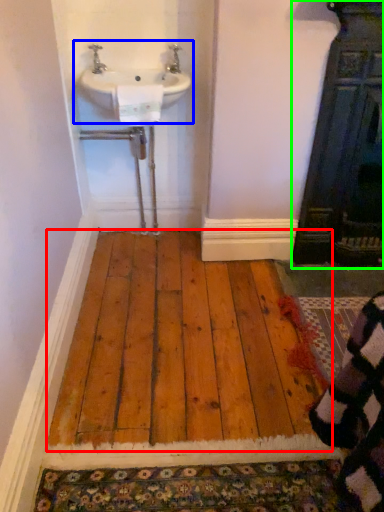
Question: Which is farther away from hardwood (highlighted by a red box)? sink (highlighted by a blue box) or door (highlighted by a green box)?

Choices:
 (A) sink
 (B) door

Answer: (A)